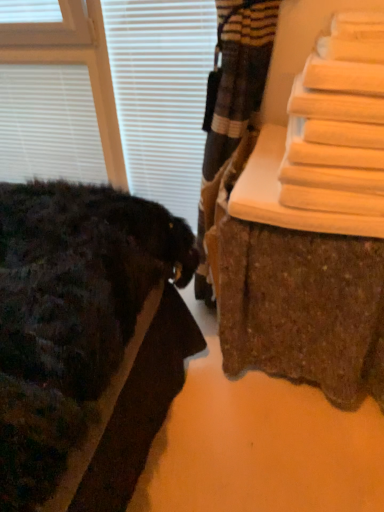
Image resolution: width=384 pixels, height=512 pixels. Identify the location of white matte blinds at upper left, which is the first blind from left to right. (49, 125).

Locate an element on the screen. wooden bench at right is located at coordinates (296, 298).

From the picture: From a real-world perspective, which is physically below, white matte blinds at upper left, placed as the 2th blind when sorted from right to left, or wooden bench at right?

In real-world perspective, wooden bench at right is lower.

Is white matte blinds at upper left, which is the first blind from left to right, situated inside wooden bench at right or outside?

white matte blinds at upper left, which is the first blind from left to right, is spatially situated outside wooden bench at right.

Which is closer, (25, 146) or (248, 251)?

Point (25, 146).

Which object is wider, white matte blinds at upper left, placed as the 2th blind when sorted from right to left, or wooden bench at right?

wooden bench at right is wider.

Can you confirm if wooden bench at right is positioned to the right of white matte blinds at upper left, placed as the 2th blind when sorted from right to left?

Correct, you'll find wooden bench at right to the right of white matte blinds at upper left, placed as the 2th blind when sorted from right to left.

Is wooden bench at right further to the viewer compared to white matte blinds at upper left, placed as the 2th blind when sorted from right to left?

That is False.

Based on the photo, would you say wooden bench at right is a long distance from white matte blinds at upper left, placed as the 2th blind when sorted from right to left?

Yes, wooden bench at right and white matte blinds at upper left, placed as the 2th blind when sorted from right to left, are located far from each other.

Would you say white matte blinds at upper left, placed as the 2th blind when sorted from right to left, is part of wooden bench at right's contents?

No, white matte blinds at upper left, placed as the 2th blind when sorted from right to left, is located outside of wooden bench at right.

Considering the positions of objects wooden bench at right and white matte blind at upper left, marked as the 2th blind in a left-to-right arrangement, in the image provided, who is more to the left, wooden bench at right or white matte blind at upper left, marked as the 2th blind in a left-to-right arrangement,?

From the viewer's perspective, white matte blind at upper left, marked as the 2th blind in a left-to-right arrangement, appears more on the left side.

Does wooden bench at right turn towards white matte blind at upper left, positioned as the 1th blind in right-to-left order?

No, wooden bench at right is not oriented towards white matte blind at upper left, positioned as the 1th blind in right-to-left order.

Can you confirm if wooden bench at right is smaller than white matte blind at upper left, marked as the 2th blind in a left-to-right arrangement?

No.

What's the angular difference between wooden bench at right and white matte blind at upper left, positioned as the 1th blind in right-to-left order,'s facing directions?

The angular difference between wooden bench at right and white matte blind at upper left, positioned as the 1th blind in right-to-left order, is 4.3 degrees.

Is white matte blind at upper left, positioned as the 1th blind in right-to-left order, at the back of white matte blinds at upper left, placed as the 2th blind when sorted from right to left?

white matte blinds at upper left, placed as the 2th blind when sorted from right to left, is not turned away from white matte blind at upper left, positioned as the 1th blind in right-to-left order.

This screenshot has height=512, width=384. I want to click on blind that is above the white matte blind at upper left, positioned as the 1th blind in right-to-left order (from the image's perspective), so coord(49,125).

In terms of size, does white matte blinds at upper left, placed as the 2th blind when sorted from right to left, appear bigger or smaller than white matte blind at upper left, positioned as the 1th blind in right-to-left order?

Considering their sizes, white matte blinds at upper left, placed as the 2th blind when sorted from right to left, takes up less space than white matte blind at upper left, positioned as the 1th blind in right-to-left order.

How distant is white matte blinds at upper left, which is the first blind from left to right, from white matte blind at upper left, marked as the 2th blind in a left-to-right arrangement?

13.33 inches.

Is white matte blind at upper left, positioned as the 1th blind in right-to-left order, bigger than wooden bench at right?

No.

From the image's perspective, is white matte blind at upper left, positioned as the 1th blind in right-to-left order, on top of wooden bench at right?

Yes, from the image's perspective, white matte blind at upper left, positioned as the 1th blind in right-to-left order, is on top of wooden bench at right.

How far apart are white matte blind at upper left, marked as the 2th blind in a left-to-right arrangement, and wooden bench at right?

white matte blind at upper left, marked as the 2th blind in a left-to-right arrangement, and wooden bench at right are 27.61 inches apart from each other.

Considering the positions of objects white matte blind at upper left, positioned as the 1th blind in right-to-left order, and wooden bench at right in the image provided, who is more to the left, white matte blind at upper left, positioned as the 1th blind in right-to-left order, or wooden bench at right?

white matte blind at upper left, positioned as the 1th blind in right-to-left order.

In terms of size, does white matte blind at upper left, positioned as the 1th blind in right-to-left order, appear bigger or smaller than white matte blinds at upper left, which is the first blind from left to right?

white matte blind at upper left, positioned as the 1th blind in right-to-left order, is bigger than white matte blinds at upper left, which is the first blind from left to right.

Who is shorter, white matte blind at upper left, marked as the 2th blind in a left-to-right arrangement, or white matte blinds at upper left, placed as the 2th blind when sorted from right to left?

white matte blinds at upper left, placed as the 2th blind when sorted from right to left.

Is white matte blind at upper left, positioned as the 1th blind in right-to-left order, touching white matte blinds at upper left, which is the first blind from left to right?

They are not placed beside each other.

At what (x,y) coordinates should I click in order to perform the action: click on furniture located in front of the white matte blinds at upper left, which is the first blind from left to right. Please return your answer as a coordinate pair (x, y). Image resolution: width=384 pixels, height=512 pixels. Looking at the image, I should click on (296, 298).

Identify the location of furniture below the white matte blinds at upper left, which is the first blind from left to right (from a real-world perspective). The height and width of the screenshot is (512, 384). (296, 298).

When comparing their distances from white matte blind at upper left, positioned as the 1th blind in right-to-left order, does wooden bench at right or white matte blinds at upper left, which is the first blind from left to right, seem closer?

white matte blinds at upper left, which is the first blind from left to right, is positioned closer to the anchor white matte blind at upper left, positioned as the 1th blind in right-to-left order.

Estimate the real-world distances between objects in this image. Which object is further from wooden bench at right, white matte blinds at upper left, placed as the 2th blind when sorted from right to left, or white matte blind at upper left, positioned as the 1th blind in right-to-left order?

Among the two, white matte blinds at upper left, placed as the 2th blind when sorted from right to left, is located further to wooden bench at right.

Estimate the real-world distances between objects in this image. Which object is closer to white matte blinds at upper left, placed as the 2th blind when sorted from right to left, wooden bench at right or white matte blind at upper left, positioned as the 1th blind in right-to-left order?

Among the two, white matte blind at upper left, positioned as the 1th blind in right-to-left order, is located nearer to white matte blinds at upper left, placed as the 2th blind when sorted from right to left.

Looking at the image, which one is located further to wooden bench at right, white matte blind at upper left, marked as the 2th blind in a left-to-right arrangement, or white matte blinds at upper left, which is the first blind from left to right?

white matte blinds at upper left, which is the first blind from left to right, is positioned further to the anchor wooden bench at right.

Estimate the real-world distances between objects in this image. Which object is closer to white matte blinds at upper left, placed as the 2th blind when sorted from right to left, white matte blind at upper left, marked as the 2th blind in a left-to-right arrangement, or wooden bench at right?

white matte blind at upper left, marked as the 2th blind in a left-to-right arrangement, lies closer to white matte blinds at upper left, placed as the 2th blind when sorted from right to left, than the other object.

Based on their spatial positions, is white matte blinds at upper left, which is the first blind from left to right, or wooden bench at right further from white matte blind at upper left, marked as the 2th blind in a left-to-right arrangement?

Based on the image, wooden bench at right appears to be further to white matte blind at upper left, marked as the 2th blind in a left-to-right arrangement.

This screenshot has height=512, width=384. Identify the location of blind located between white matte blinds at upper left, which is the first blind from left to right, and wooden bench at right in the left-right direction. (162, 94).